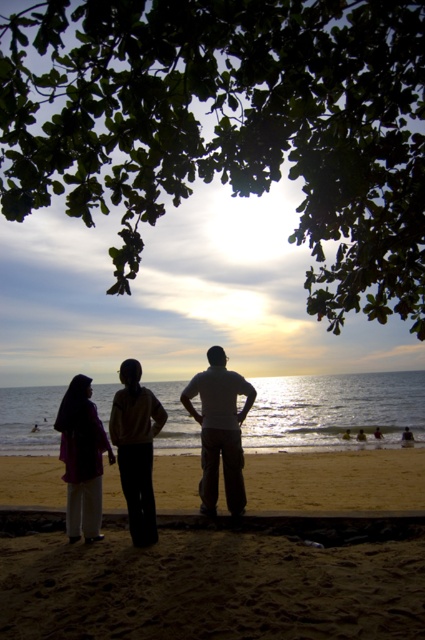
You are standing on the beach and want to place a 4.5 meter long wooden board between the green leafy tree at upper center and the silhouette clothing at center. Can you fit the board horizontally between them without bending it?

The distance between the green leafy tree at upper center and the silhouette clothing at center is 3.90 meters. Since the board is 4.5 meters long, it cannot be placed horizontally between them without bending because it is longer than the available space.

You are a photographer planning to take a sunset photo. You want to include both the green leafy tree at upper center and the sandy beach at lower center in your frame. Which object should you focus on first to ensure both are in the shot?

You should focus on the green leafy tree at upper center first because it is larger in size than the sandy beach at lower center, so ensuring it is centered will help frame the smaller sandy beach at lower center appropriately.

You are a drone operator trying to capture the sunset scene. You need to position your drone to focus on the green leafy tree at upper center. According to the coordinates provided, where should you place the drone to ensure the tree is centered in the frame?

The green leafy tree at upper center is located at coordinates point (231, 125), so you should position the drone to center the frame at those coordinates to capture the tree.